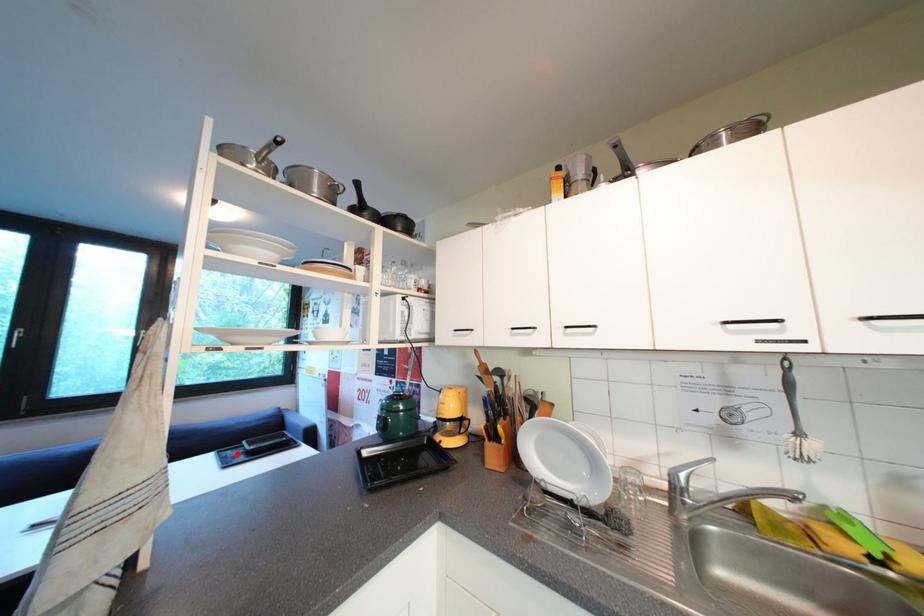
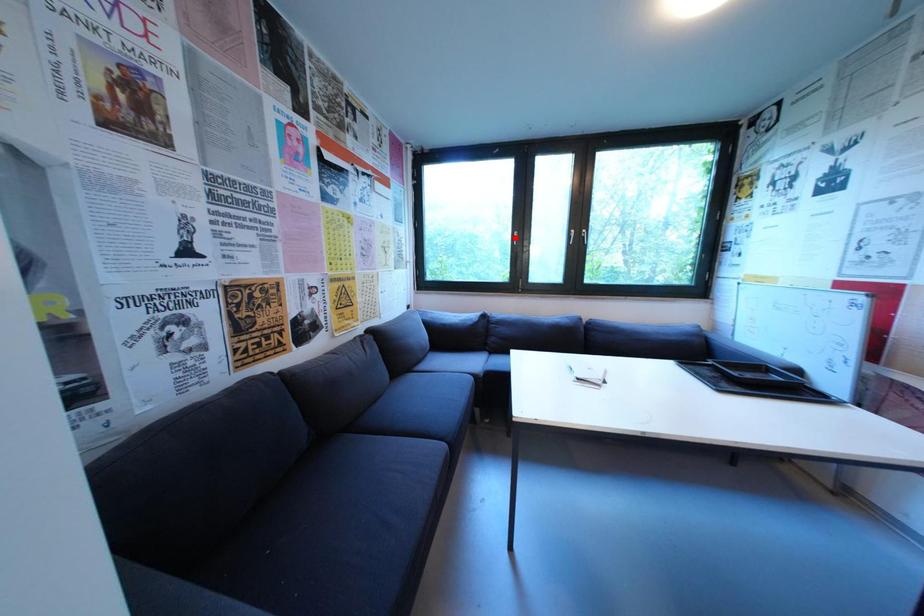
I am providing you with two images of the same scene from different viewpoints. A red point is marked on the first image and another point is marked on the second image. Are the points marked in image1 and image2 representing the same 3D position?

No